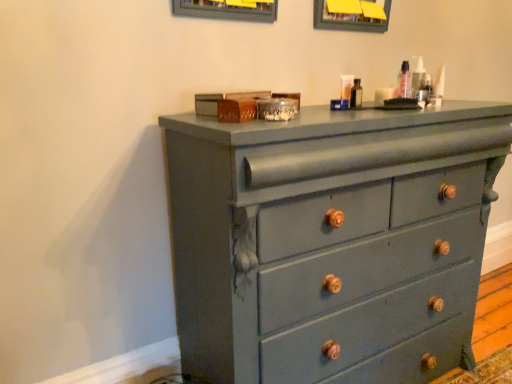
Locate an element on the screen. The height and width of the screenshot is (384, 512). matte gray dresser at center is located at coordinates (331, 241).

Is matte gray dresser at center located within matte gray picture frame at upper center?

Actually, matte gray dresser at center is outside matte gray picture frame at upper center.

From a real-world perspective, relative to matte gray dresser at center, is matte gray picture frame at upper center vertically above or below?

Clearly, from a real-world perspective, matte gray picture frame at upper center is above matte gray dresser at center.

Could you tell me if matte gray picture frame at upper center is facing matte gray dresser at center?

No, matte gray picture frame at upper center does not turn towards matte gray dresser at center.

Is matte plastic container at upper right located outside matte gray dresser at center?

Yes, matte plastic container at upper right is not within matte gray dresser at center.

Does matte plastic container at upper right have a lesser width compared to matte gray dresser at center?

Yes, matte plastic container at upper right is thinner than matte gray dresser at center.

Is matte plastic container at upper right looking in the opposite direction of matte gray dresser at center?

No, matte gray dresser at center is not at the back of matte plastic container at upper right.

From a real-world perspective, relative to matte gray dresser at center, is matte plastic container at upper right vertically above or below?

matte plastic container at upper right is situated higher than matte gray dresser at center in the real world.

Considering the sizes of objects matte plastic container at upper right and matte gray picture frame at upper center in the image provided, who is thinner, matte plastic container at upper right or matte gray picture frame at upper center?

matte gray picture frame at upper center.

Does matte plastic container at upper right lie in front of matte gray picture frame at upper center?

Yes.

How many degrees apart are the facing directions of matte plastic container at upper right and matte gray picture frame at upper center?

The angular difference between matte plastic container at upper right and matte gray picture frame at upper center is 1.1 degrees.

Considering the sizes of matte plastic container at upper right and matte gray picture frame at upper center in the image, is matte plastic container at upper right taller or shorter than matte gray picture frame at upper center?

Considering their sizes, matte plastic container at upper right has less height than matte gray picture frame at upper center.

Between matte gray dresser at center and matte plastic container at upper right, which one has less height?

Standing shorter between the two is matte plastic container at upper right.

You are a GUI agent. You are given a task and a screenshot of the screen. Output one action in this format:
    pyautogui.click(x=<x>, y=<y>)
    Task: Click on the toiletry above the matte gray dresser at center (from a real-world perspective)
    Image resolution: width=512 pixels, height=384 pixels.
    Given the screenshot: What is the action you would take?
    pyautogui.click(x=417, y=75)

From the image's perspective, which one is positioned higher, matte gray dresser at center or matte plastic container at upper right?

From the image's view, matte plastic container at upper right is above.

Does matte gray dresser at center lie in front of matte plastic container at upper right?

Yes, it is.

This screenshot has width=512, height=384. I want to click on picture frame above the matte plastic container at upper right (from the image's perspective), so click(x=352, y=15).

Is matte gray picture frame at upper center oriented towards matte plastic container at upper right?

No, matte gray picture frame at upper center does not turn towards matte plastic container at upper right.

Measure the distance between matte gray picture frame at upper center and matte plastic container at upper right.

matte gray picture frame at upper center and matte plastic container at upper right are 16.23 inches apart from each other.

Is point (258, 375) farther from camera compared to point (377, 29)?

No, it is not.

From a real-world perspective, is matte gray dresser at center located higher than matte gray picture frame at upper center?

No.

What are the coordinates of `picture frame behind the matte gray dresser at center` in the screenshot? It's located at (352, 15).

Is matte gray dresser at center placed right next to matte gray picture frame at upper center?

matte gray dresser at center and matte gray picture frame at upper center are clearly separated.

Where is `picture frame behind the matte gray dresser at center`? picture frame behind the matte gray dresser at center is located at coordinates (352, 15).

Locate an element on the screen. chest of drawers on the left of matte plastic container at upper right is located at coordinates (331, 241).

Which object lies further to the anchor point matte gray dresser at center, matte gray picture frame at upper center or matte plastic container at upper right?

matte gray picture frame at upper center is further to matte gray dresser at center.

Considering their positions, is matte gray picture frame at upper center positioned closer to matte plastic container at upper right than matte gray dresser at center?

Based on the image, matte gray picture frame at upper center appears to be nearer to matte plastic container at upper right.

Looking at the image, which one is located further to matte plastic container at upper right, matte gray dresser at center or matte gray picture frame at upper center?

matte gray dresser at center.

Estimate the real-world distances between objects in this image. Which object is further from matte gray picture frame at upper center, matte plastic container at upper right or matte gray dresser at center?

Based on the image, matte gray dresser at center appears to be further to matte gray picture frame at upper center.

Based on their spatial positions, is matte plastic container at upper right or matte gray picture frame at upper center further from matte gray dresser at center?

matte gray picture frame at upper center is further to matte gray dresser at center.

Estimate the real-world distances between objects in this image. Which object is closer to matte gray picture frame at upper center, matte gray dresser at center or matte plastic container at upper right?

Among the two, matte plastic container at upper right is located nearer to matte gray picture frame at upper center.

This screenshot has height=384, width=512. Identify the location of toiletry between matte gray picture frame at upper center and matte gray dresser at center in the up-down direction. (417, 75).